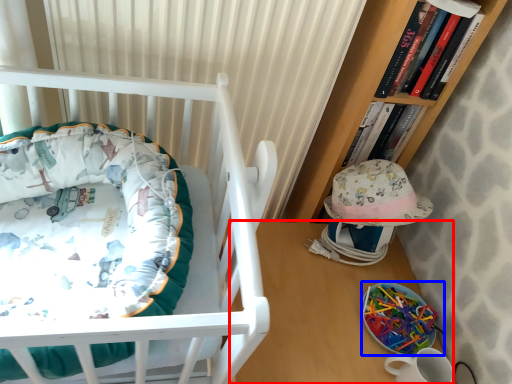
Question: Among these objects, which one is nearest to the camera, table (highlighted by a red box) or equipment (highlighted by a blue box)?

Choices:
 (A) table
 (B) equipment

Answer: (A)